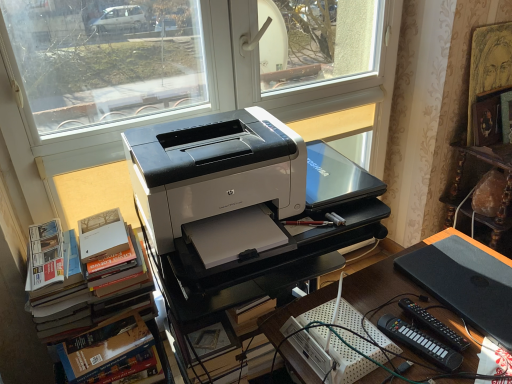
Locate an element on the screen. Image resolution: width=512 pixels, height=384 pixels. vacant region to the left of black matte laptop at lower right is located at coordinates (390, 304).